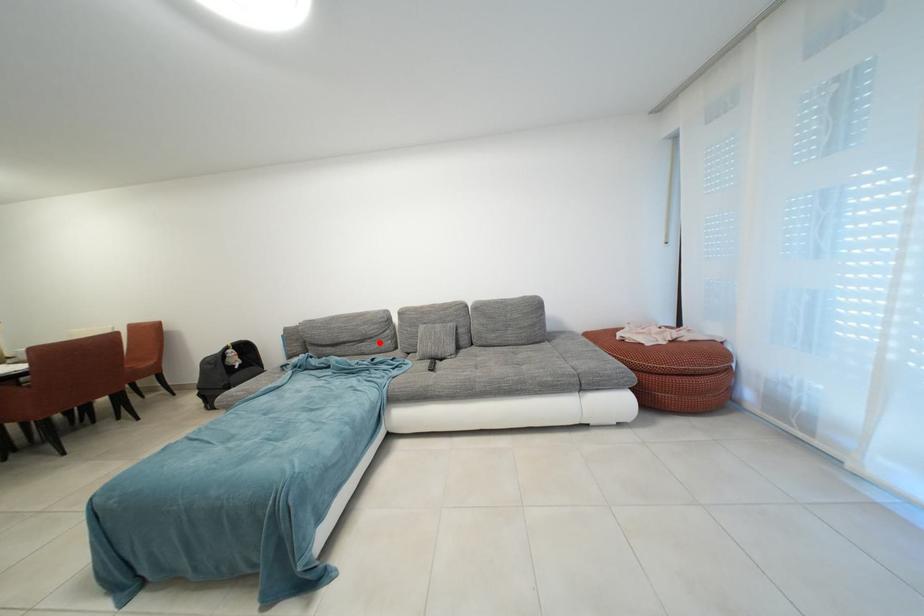
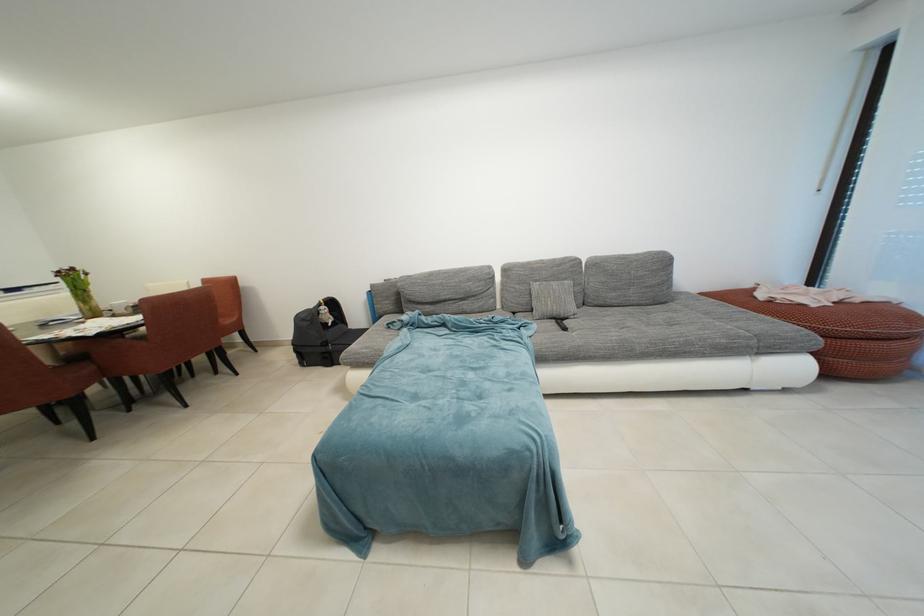
Find the pixel in the second image that matches the highlighted location in the first image.

(482, 301)